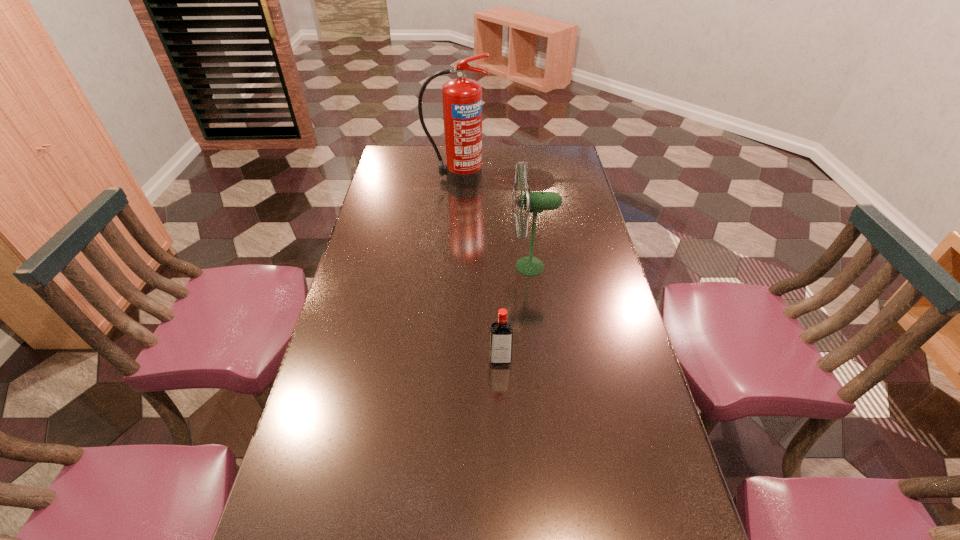
Where is `the farthest object`? The image size is (960, 540). the farthest object is located at coordinates (462, 98).

At what (x,y) coordinates should I click in order to perform the action: click on fire extinguisher. Please return your answer as a coordinate pair (x, y). The height and width of the screenshot is (540, 960). Looking at the image, I should click on (462, 98).

You are a GUI agent. You are given a task and a screenshot of the screen. Output one action in this format:
    pyautogui.click(x=<x>, y=<y>)
    Task: Click on the second tallest object
    The width and height of the screenshot is (960, 540).
    Given the screenshot: What is the action you would take?
    pyautogui.click(x=533, y=202)

Identify the location of fan. (x=533, y=202).

Find the location of a particular element. The height and width of the screenshot is (540, 960). the nearest object is located at coordinates (501, 335).

Image resolution: width=960 pixels, height=540 pixels. In order to click on vodka in this screenshot , I will do `click(501, 335)`.

The width and height of the screenshot is (960, 540). Find the location of `free region located 0.390m on the surface of the farthest object`. free region located 0.390m on the surface of the farthest object is located at coordinates pyautogui.click(x=451, y=251).

Image resolution: width=960 pixels, height=540 pixels. Find the location of `vacant space positioned 0.190m on the front-facing side of the rightmost object`. vacant space positioned 0.190m on the front-facing side of the rightmost object is located at coordinates (451, 266).

In order to click on vacant space situated on the front-facing side of the rightmost object in this screenshot , I will do `click(442, 266)`.

Identify the location of vacant space situated on the front-facing side of the rightmost object. This screenshot has width=960, height=540. (420, 266).